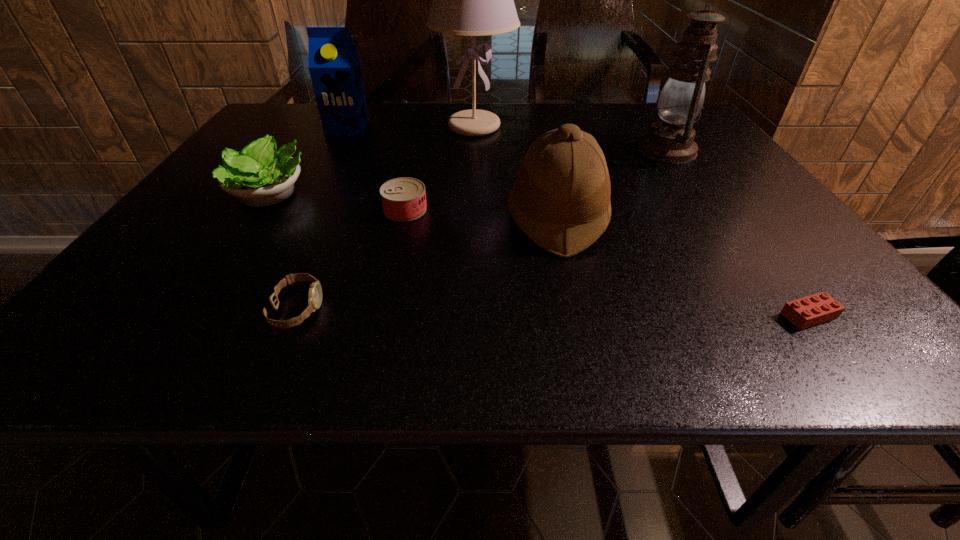
At what (x,y) coordinates should I click in order to perform the action: click on watch at the near edge. Please return your answer as a coordinate pair (x, y). The height and width of the screenshot is (540, 960). Looking at the image, I should click on point(315,291).

Find the location of a particular element. Lego located in the near edge section of the desktop is located at coordinates (812, 310).

Find the location of a particular element. object that is at the left edge is located at coordinates (259, 175).

Find the location of a particular element. The height and width of the screenshot is (540, 960). oil lamp located in the right edge section of the desktop is located at coordinates (671, 141).

The height and width of the screenshot is (540, 960). Identify the location of Lego that is at the right edge. (812, 310).

Where is `object at the near right corner`? Image resolution: width=960 pixels, height=540 pixels. object at the near right corner is located at coordinates (812, 310).

In the image, there is a desktop. At what (x,y) coordinates should I click in order to perform the action: click on vacant space at the far edge. Please return your answer as a coordinate pair (x, y). This screenshot has height=540, width=960. Looking at the image, I should click on (402, 127).

Image resolution: width=960 pixels, height=540 pixels. I want to click on free region at the left edge of the desktop, so click(224, 213).

Where is `free location at the right edge`? Image resolution: width=960 pixels, height=540 pixels. free location at the right edge is located at coordinates (796, 268).

At what (x,y) coordinates should I click in order to perform the action: click on free point between the hat and the carton. Please return your answer as a coordinate pair (x, y). The image size is (960, 540). Looking at the image, I should click on (452, 173).